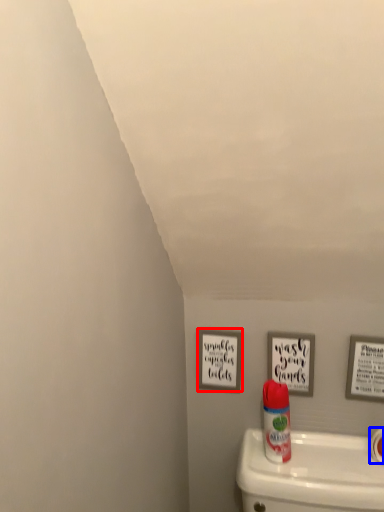
Question: Among these objects, which one is farthest to the camera, picture frame (highlighted by a red box) or toilet paper (highlighted by a blue box)?

Choices:
 (A) picture frame
 (B) toilet paper

Answer: (A)